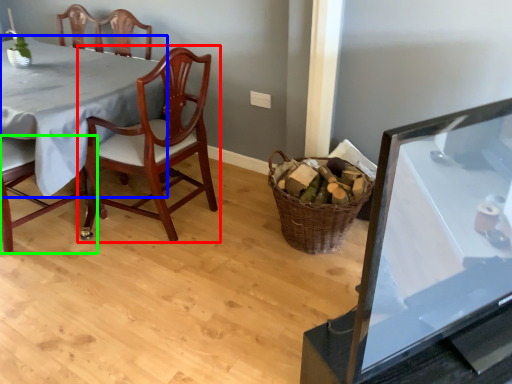
Question: Estimate the real-world distances between objects in this image. Which object is closer to chair (highlighted by a red box), table (highlighted by a blue box) or chair (highlighted by a green box)?

Choices:
 (A) table
 (B) chair

Answer: (A)